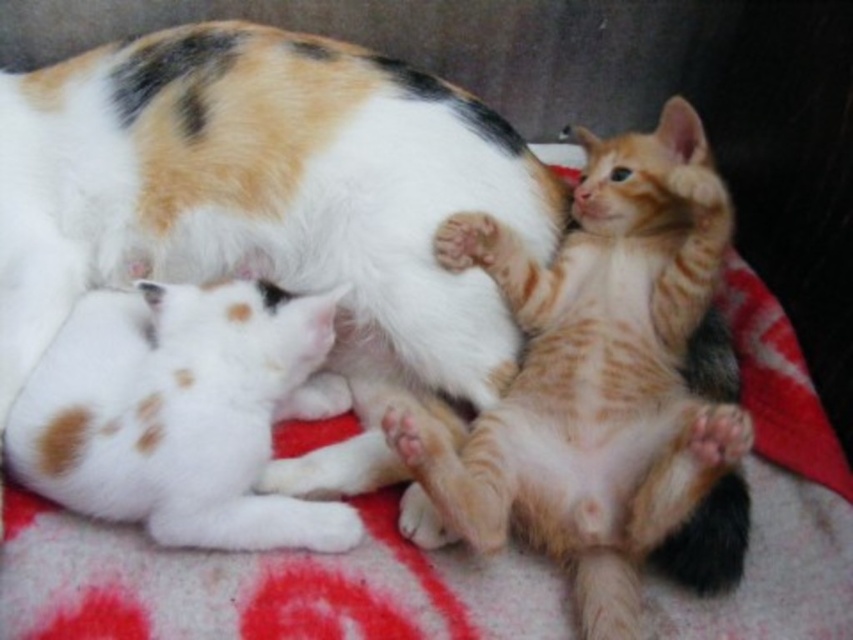
Question: Which point is closer to the camera?

Choices:
 (A) orange tabby kitten at center
 (B) white soft fur kitten at lower left

Answer: (A)

Question: Among these objects, which one is nearest to the camera?

Choices:
 (A) white soft fur kitten at lower left
 (B) orange tabby kitten at center

Answer: (B)

Question: Which point is farther from the camera taking this photo?

Choices:
 (A) (631, 538)
 (B) (126, 388)

Answer: (B)

Question: Does orange tabby kitten at center appear on the left side of white soft fur kitten at lower left?

Choices:
 (A) yes
 (B) no

Answer: (B)

Question: Can you confirm if orange tabby kitten at center is bigger than white soft fur kitten at lower left?

Choices:
 (A) no
 (B) yes

Answer: (B)

Question: Is orange tabby kitten at center to the left of white soft fur kitten at lower left from the viewer's perspective?

Choices:
 (A) yes
 (B) no

Answer: (B)